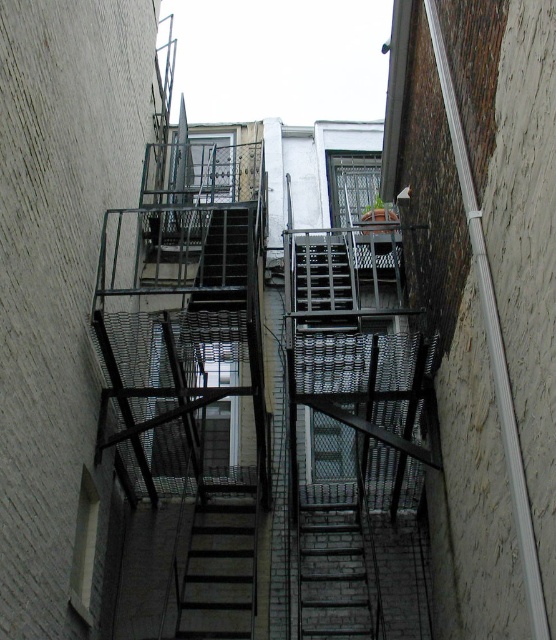
A drone is flying at a point [309,531] in the image. The drone needs to deliver a package to a location that is exactly halfway between the two fire escapes. Is the drone currently positioned at the correct location?

The two fire escapes are 49.59 feet apart. The halfway point would be at 24.795 feet from each fire escape. The drone is at point [309,531], which is not necessarily the halfway point unless the coordinate system aligns with the distance between them. Without knowing the coordinate system scale, we can only state the halfway distance is 24.795 feet from each fire escape.

You are a delivery person carrying a large package and need to climb the stairs in the alley. Which stairs, the brick stairs at center or the metallic gray stairs at center, should you choose if you want to take the wider option?

The brick stairs at center is larger in size than metallic gray stairs at center, so you should choose the brick stairs at center for a wider option.